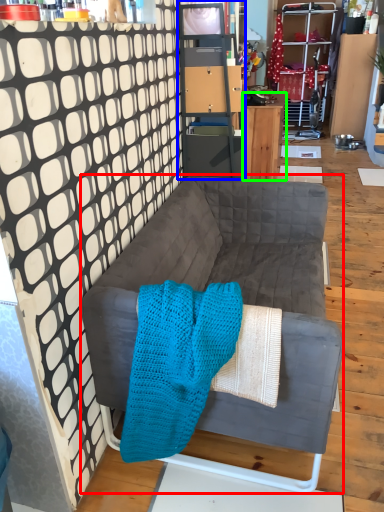
Question: Estimate the real-world distances between objects in this image. Which object is closer to studio couch (highlighted by a red box), cabinetry (highlighted by a blue box) or desk (highlighted by a green box)?

Choices:
 (A) cabinetry
 (B) desk

Answer: (A)